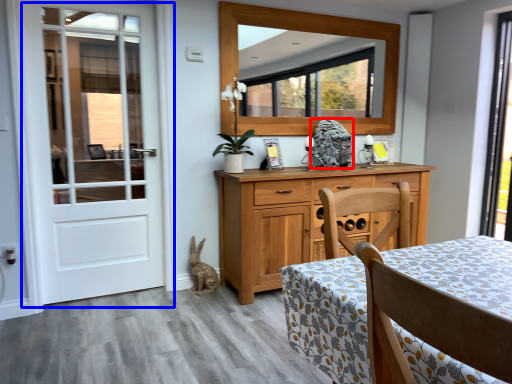
Question: Which object appears farthest to the camera in this image, animal (highlighted by a red box) or door (highlighted by a blue box)?

Choices:
 (A) animal
 (B) door

Answer: (A)